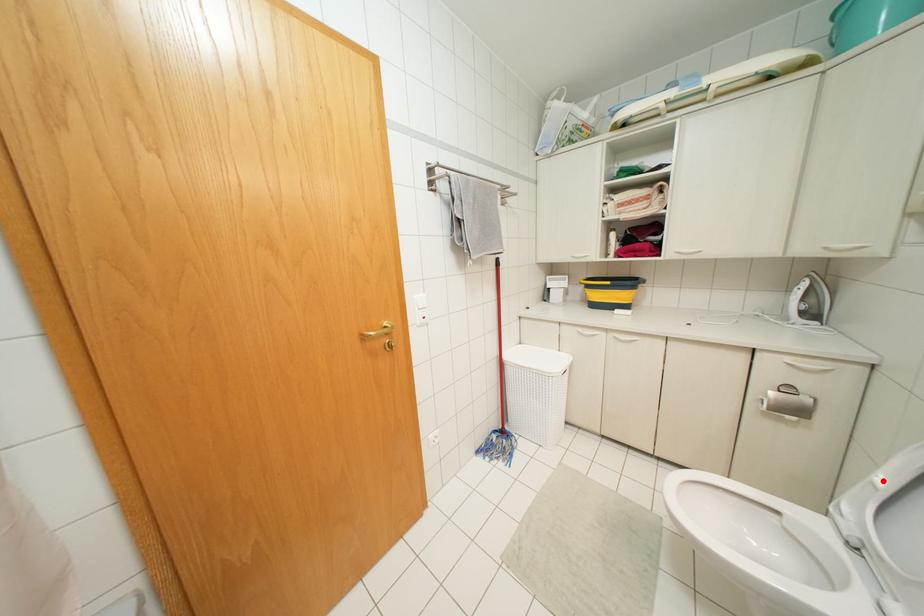
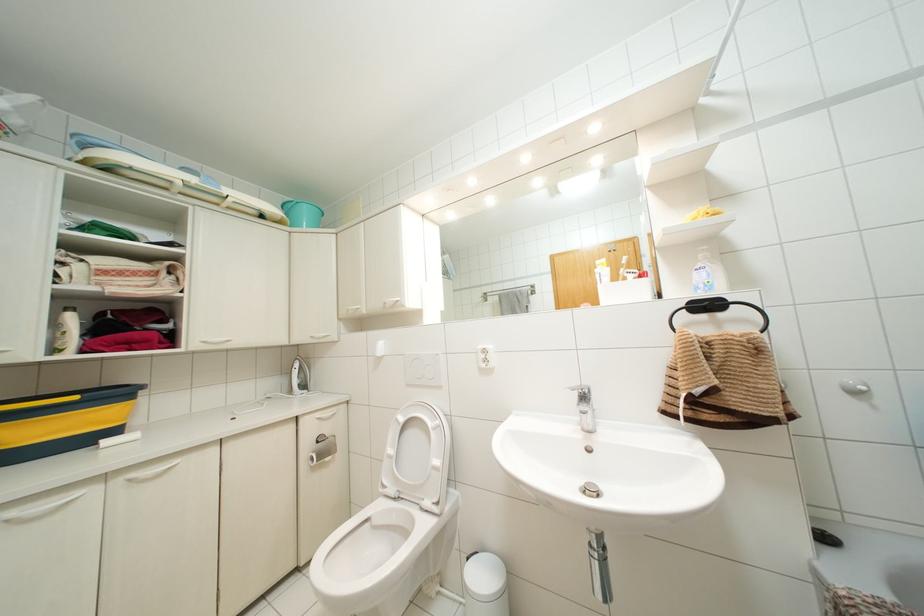
Locate, in the second image, the point that corresponds to the highlighted location in the first image.

(390, 450)